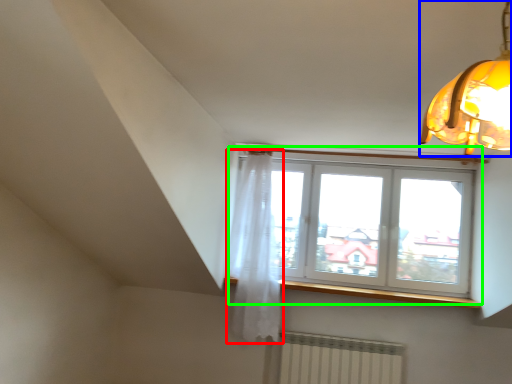
Question: Estimate the real-world distances between objects in this image. Which object is farther from curtain (highlighted by a red box), lamp (highlighted by a blue box) or window (highlighted by a green box)?

Choices:
 (A) lamp
 (B) window

Answer: (A)